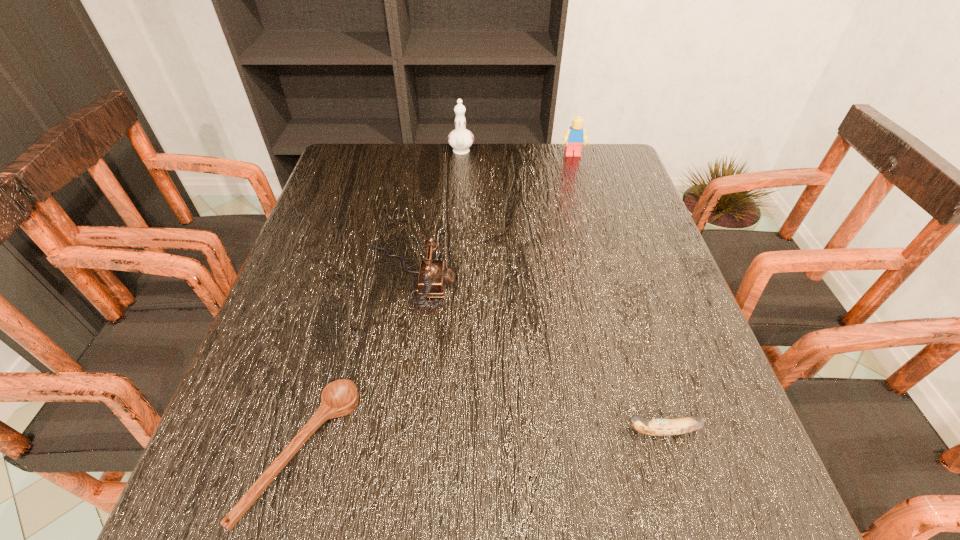
Locate an element on the screen. This screenshot has height=540, width=960. vacant region between the chinaware and the wooden spoon is located at coordinates (382, 302).

The width and height of the screenshot is (960, 540). In order to click on vacant area that lies between the Lego and the tallest object in this screenshot , I will do `click(516, 154)`.

Where is `free spot between the second shortest object and the Lego`? Image resolution: width=960 pixels, height=540 pixels. free spot between the second shortest object and the Lego is located at coordinates (617, 293).

This screenshot has width=960, height=540. Identify the location of free space between the banana and the chinaware. (562, 292).

Image resolution: width=960 pixels, height=540 pixels. I want to click on vacant space that is in between the wooden spoon and the telephone, so click(355, 366).

The image size is (960, 540). I want to click on free space between the tallest object and the third shortest object, so click(434, 215).

I want to click on vacant area between the second shortest object and the shortest object, so click(x=482, y=442).

The height and width of the screenshot is (540, 960). Identify the location of vacant space that is in between the Lego and the chinaware. (516, 154).

Where is `object that can be found as the closest to the tallest object`? The width and height of the screenshot is (960, 540). object that can be found as the closest to the tallest object is located at coordinates (575, 136).

Identify the location of the second closest object to the chinaware. (432, 279).